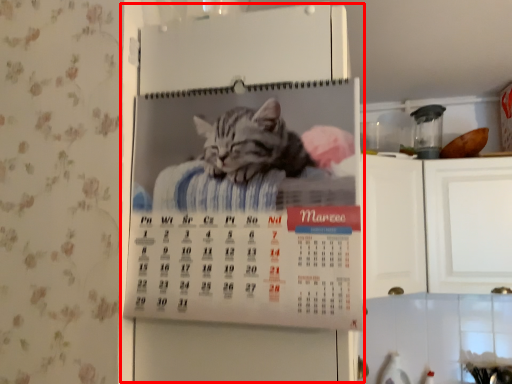
Question: From the image's perspective, what is the correct spatial relationship of appliance (annotated by the red box) in relation to appliance?

Choices:
 (A) below
 (B) above

Answer: (A)